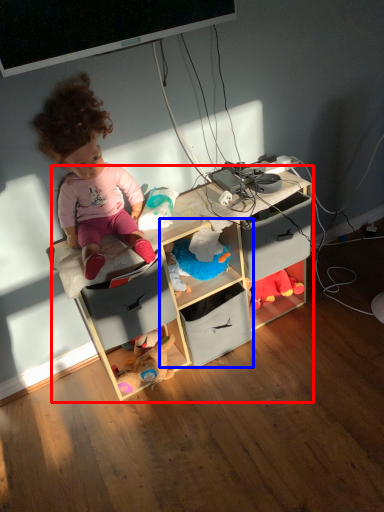
Question: Which of the following is the closest to the observer, shelf (highlighted by a red box) or shelf (highlighted by a blue box)?

Choices:
 (A) shelf
 (B) shelf

Answer: (A)